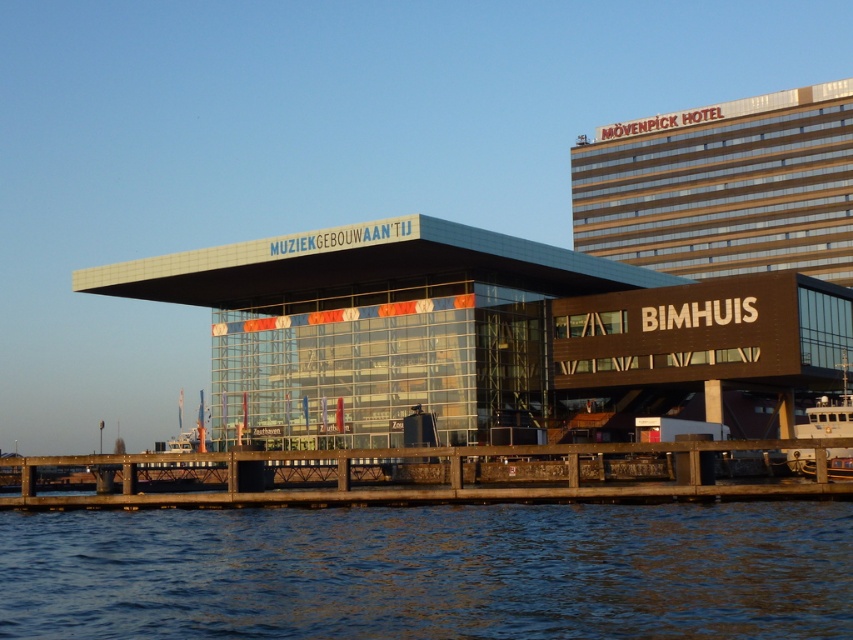
Based on the scene description, where exactly is the gold reflective glass building at upper right located in terms of its 2D coordinates?

The gold reflective glass building at upper right is located at the 2D coordinates point [723,186].

You are standing on the brown wooden dock at lower center and looking towards the gold reflective glass building at upper right. Which direction should you face to see the building?

You should face upwards because the gold reflective glass building at upper right is located above the brown wooden dock at lower center.

You are a drone operator planning to fly a drone from the blue liquid water at lower center to the gold reflective glass building at upper right. The drone has a maximum flight range of 400 feet. Can the drone reach its destination without recharging?

The blue liquid water at lower center and gold reflective glass building at upper right are 401.17 feet apart from each other, so the drone cannot reach its destination without recharging since the distance exceeds its maximum range of 400 feet.